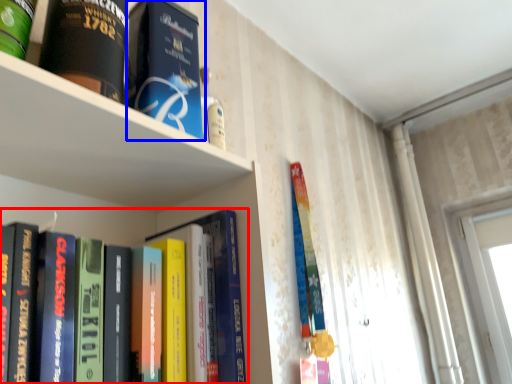
Question: Which point is further to the camera, book (highlighted by a red box) or book (highlighted by a blue box)?

Choices:
 (A) book
 (B) book

Answer: (B)